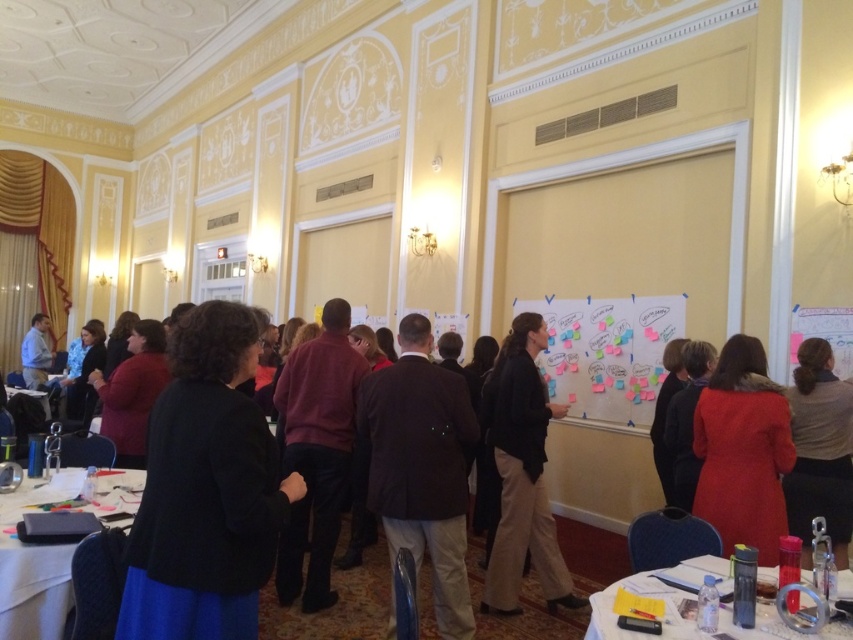
You are a participant in the meeting and need to place your notebook on the white plastic table at lower left and the translucent plastic water bottle at lower right. Which object should you approach first if you want to place your notebook on the table and then grab the water bottle?

You should first approach the white plastic table at lower left because it is positioned on the left side of the translucent plastic water bottle at lower right, so you can place your notebook there first before moving to the water bottle on the right.